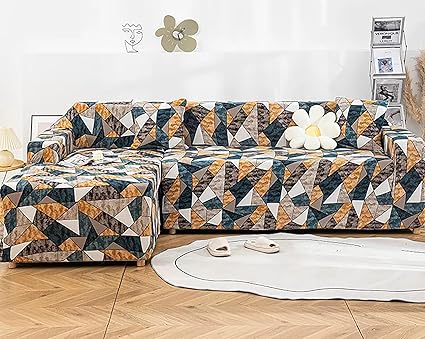
This screenshot has height=339, width=425. I want to click on quilted sofa cover, so click(x=250, y=188).